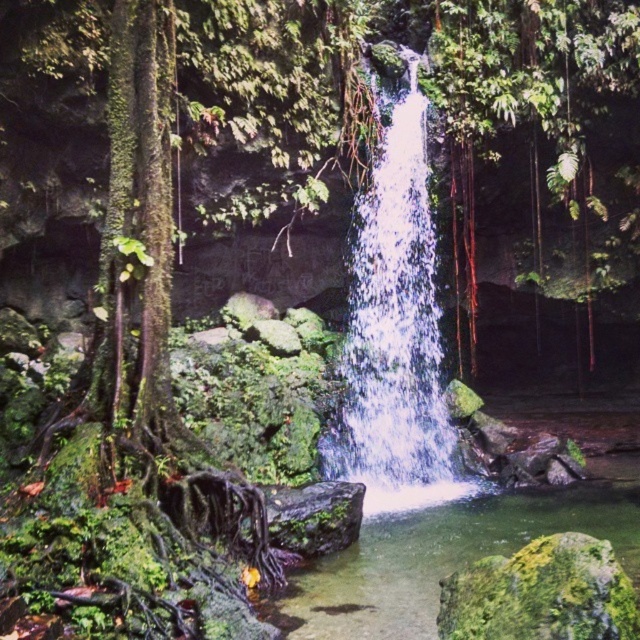
You are standing at the edge of the waterfall pool and want to reach a specific point marked at coordinates point (x=452, y=557). If your maximum comfortable walking distance is 6 meters, can you safely reach that point without needing to swim?

The distance of point (x=452, y=557) from viewer is 6.39 meters, which exceeds your maximum comfortable walking distance of 6 meters. Therefore, you may need to swim or find another path to reach it safely.

You are a photographer planning to capture the waterfall scene. You notice two types of water in the image. Which one is narrower in width between the white frothy water at center and the clear water at center?

The white frothy water at center has a lesser width compared to clear water at center, so the white frothy water at center is narrower in width.

You are a photographer planning to capture the waterfall scene. You want to highlight both the white frothy water at center and the clear water at center in your shot. Which of these two waters should you focus on first if you want to emphasize the larger feature?

The white frothy water at center has a larger size compared to the clear water at center, so you should focus on the white frothy water at center first to emphasize the larger feature.